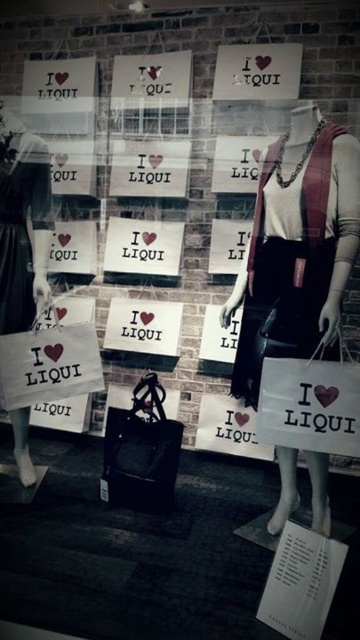
You are a store manager checking the display. You need to place a new rectangular decorative plaque between the matte black dress at center and the black satin dress at left. Which side of the plaque should face the wider dress to ensure proper alignment?

The matte black dress at center might be wider than black satin dress at left, so the plaque should be aligned with the wider side facing the matte black dress at center to maintain symmetry.

You are a customer looking at the retail display and want to pick up the white paper bag at left and the black satin dress at left. Which item should you move first to the right to access the other?

The white paper bag at left is positioned on the right side of black satin dress at left. To access the black satin dress at left, you should move the white paper bag at left to the right first.

You are a store employee arranging items on a shelf. You need to place a new promotional sign that must be positioned directly above the matte black dress at center. According to the store layout, the shelf is at point 0.4, 0.8. Can you place the sign there?

The matte black dress at center is located at point (297, 250). The shelf is at point (288, 256). The coordinates are very close, so the sign can be placed there as it aligns with the dress.